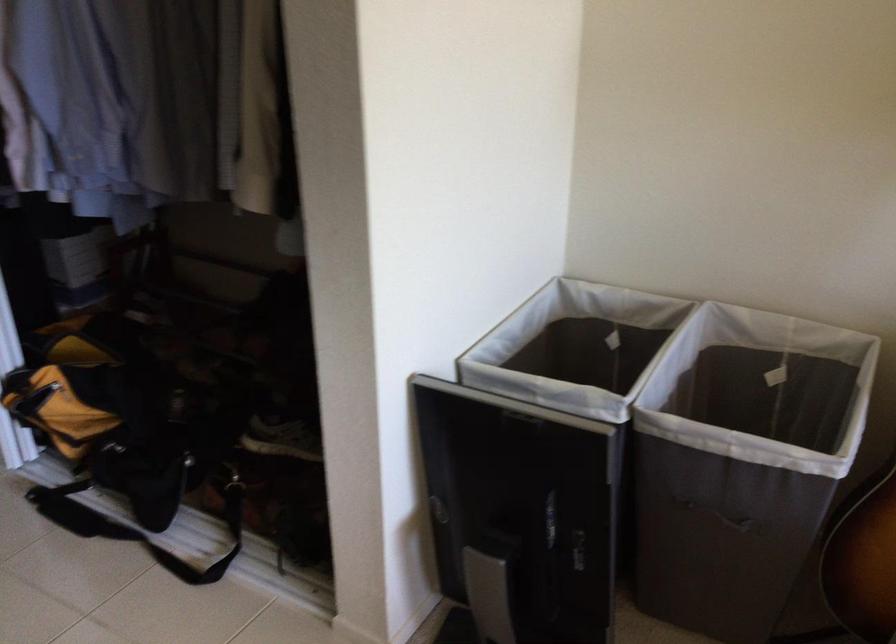
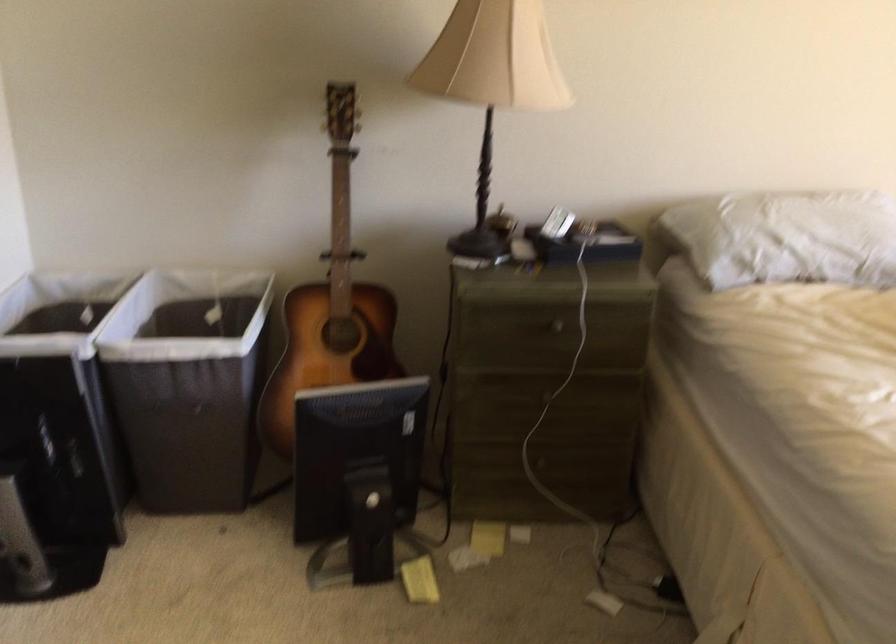
Question: The first image is from the beginning of the video and the second image is from the end. How did the camera likely rotate when shooting the video?

Choices:
 (A) Left
 (B) Right
 (C) Up
 (D) Down

Answer: (B)